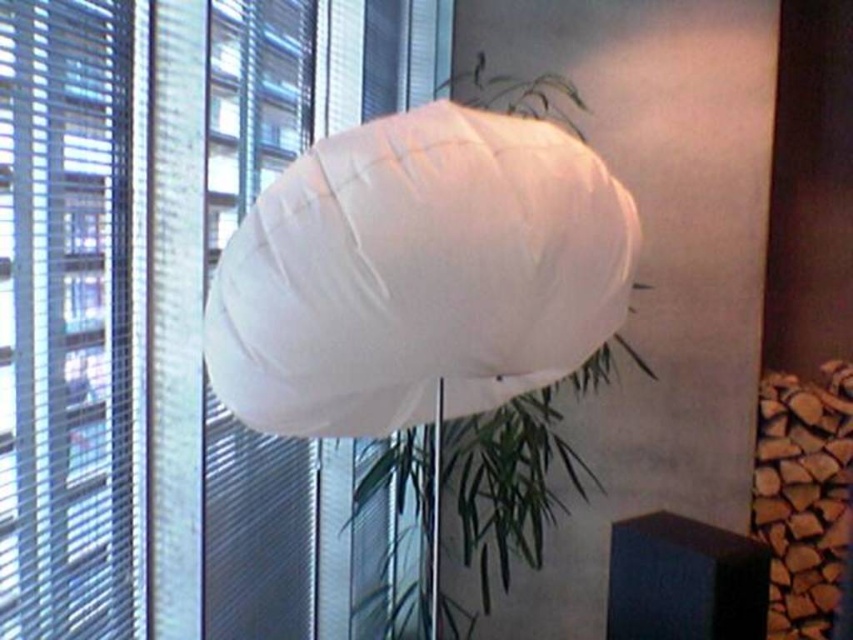
Question: Which point appears closest to the camera in this image?

Choices:
 (A) (410, 404)
 (B) (16, 272)

Answer: (B)

Question: Estimate the real-world distances between objects in this image. Which object is farther from the white fabric lamp at center?

Choices:
 (A) white matte blind at upper center
 (B) transparent plastic blinds at left

Answer: (A)

Question: From the image, what is the correct spatial relationship of white matte blind at upper center in relation to white fabric lamp at center?

Choices:
 (A) left
 (B) right

Answer: (A)

Question: Which object is positioned farthest from the white fabric lamp at center?

Choices:
 (A) white matte blind at upper center
 (B) transparent plastic blinds at left

Answer: (A)

Question: Can you confirm if white fabric lamp at center is wider than transparent plastic blinds at left?

Choices:
 (A) yes
 (B) no

Answer: (A)

Question: Is white matte blind at upper center in front of transparent plastic blinds at left?

Choices:
 (A) no
 (B) yes

Answer: (A)